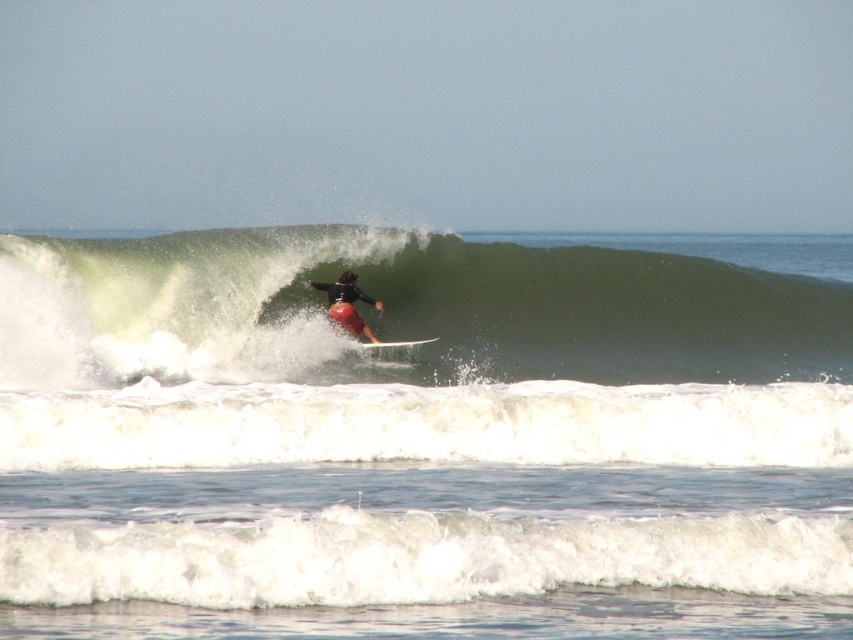
You are a photographer trying to capture the surfer in the image. Since the matte black wetsuit at center and the white glossy surfboard at center are both in the frame, which object is covering the other?

The matte black wetsuit at center is positioned over the white glossy surfboard at center, so the wetsuit is covering the surfboard.

You are a photographer trying to capture the surfer in the center of the image. The surfer is at point (793, 362) and there is a distant landmark at point (387, 342). Which point should you focus on to ensure the surfer is sharp while keeping the landmark in the background?

You should focus on point (793, 362) because it is closer to the viewer than point (387, 342). This ensures the surfer is in focus while the landmark remains in the background.

You are a photographer trying to capture the surfer in the center. The matte black wetsuit at center and the white glossy surfboard at center are both in focus. Which object is wider in the image?

The matte black wetsuit at center might be wider than white glossy surfboard at center.